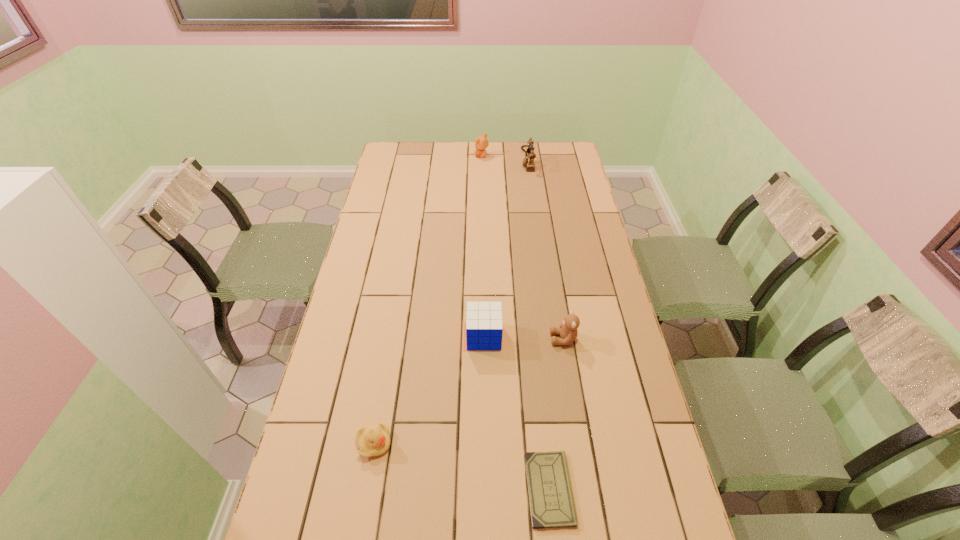
You are a GUI agent. You are given a task and a screenshot of the screen. Output one action in this format:
    pyautogui.click(x=<x>, y=<y>)
    Task: Click on the telephone
    Image resolution: width=960 pixels, height=540 pixels.
    Given the screenshot: What is the action you would take?
    pyautogui.click(x=528, y=162)

What are the coordinates of `the left teddy bear` in the screenshot? It's located at (481, 142).

This screenshot has height=540, width=960. I want to click on the right teddy bear, so click(568, 332).

Locate an element on the screen. This screenshot has height=540, width=960. cube is located at coordinates 484,327.

At what (x,y) coordinates should I click in order to perform the action: click on the leftmost object. Please return your answer as a coordinate pair (x, y). This screenshot has width=960, height=540. Looking at the image, I should click on (372, 440).

This screenshot has width=960, height=540. What are the coordinates of `duckling` in the screenshot? It's located at (372, 440).

Identify the location of checkbook. (551, 500).

You are a GUI agent. You are given a task and a screenshot of the screen. Output one action in this format:
    pyautogui.click(x=<x>, y=<y>)
    Task: Click on the vacant space located 0.370m on the front-facing side of the telephone
    Image resolution: width=960 pixels, height=540 pixels.
    Given the screenshot: What is the action you would take?
    pyautogui.click(x=444, y=160)

Identify the location of vacant space positioned on the front-facing side of the telephone. Image resolution: width=960 pixels, height=540 pixels. (496, 160).

Identify the location of vacant space positioned 0.390m on the front-facing side of the telephone. (440, 160).